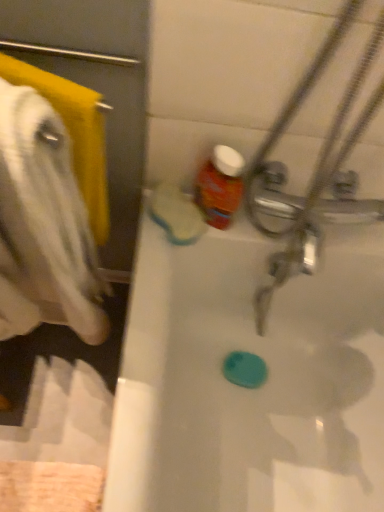
Identify the location of white glossy bathtub at center. (249, 390).

The image size is (384, 512). Find the location of `matte plastic bottle at upper center`. matte plastic bottle at upper center is located at coordinates (220, 186).

Which of these two, white glossy bathtub at center or matte plastic bottle at upper center, is thinner?

With smaller width is matte plastic bottle at upper center.

Are white glossy bathtub at center and matte plastic bottle at upper center located far from each other?

No, white glossy bathtub at center is not far away from matte plastic bottle at upper center.

Which is closer to the camera, (172, 169) or (210, 178)?

Point (172, 169) is farther from the camera than point (210, 178).

Is white glossy bathtub at center in front of matte plastic bottle at upper center?

Yes, white glossy bathtub at center is closer to the viewer.

In the scene shown: What's the angular difference between matte plastic bottle at upper center and white glossy bathtub at center's facing directions?

The angular difference between matte plastic bottle at upper center and white glossy bathtub at center is 92.3 degrees.

Would you consider matte plastic bottle at upper center to be distant from white glossy bathtub at center?

No, there isn't a large distance between matte plastic bottle at upper center and white glossy bathtub at center.

Who is taller, matte plastic bottle at upper center or white glossy bathtub at center?

With more height is white glossy bathtub at center.

Where is `bottle above the white glossy bathtub at center (from a real-world perspective)`? The width and height of the screenshot is (384, 512). bottle above the white glossy bathtub at center (from a real-world perspective) is located at coordinates (220, 186).

Who is taller, white soft towel at left or white glossy bathtub at center?

With more height is white glossy bathtub at center.

The image size is (384, 512). Find the location of `towel/napkin on the left of white glossy bathtub at center`. towel/napkin on the left of white glossy bathtub at center is located at coordinates (74, 133).

Which is behind, point (85, 158) or point (122, 390)?

The point (122, 390) is more distant.

From a real-world perspective, is white soft towel at left located beneath white glossy bathtub at center?

No, from a real-world perspective, white soft towel at left is not under white glossy bathtub at center.

Is matte plastic bottle at upper center not within white soft towel at left?

Absolutely, matte plastic bottle at upper center is external to white soft towel at left.

From a real-world perspective, which is physically above, matte plastic bottle at upper center or white soft towel at left?

From a 3D spatial view, white soft towel at left is above.

From the image's perspective, is matte plastic bottle at upper center on top of white soft towel at left?

No, from the image's perspective, matte plastic bottle at upper center is not over white soft towel at left.

Which object is further away from the camera taking this photo, white soft towel at left or matte plastic bottle at upper center?

matte plastic bottle at upper center is more distant.

Is white soft towel at left facing towards matte plastic bottle at upper center?

No.

Between white soft towel at left and matte plastic bottle at upper center, which one has smaller width?

Thinner between the two is matte plastic bottle at upper center.

Image resolution: width=384 pixels, height=512 pixels. What are the coordinates of `bottle below the white soft towel at left (from a real-world perspective)` in the screenshot? It's located at (220, 186).

Which of these two, white glossy bathtub at center or white soft towel at left, is wider?

Wider between the two is white glossy bathtub at center.

Where is `towel/napkin above the white glossy bathtub at center (from a real-world perspective)`? towel/napkin above the white glossy bathtub at center (from a real-world perspective) is located at coordinates (74, 133).

How different are the orientations of white glossy bathtub at center and white soft towel at left in degrees?

There is a 64.1-degree angle between the facing directions of white glossy bathtub at center and white soft towel at left.

Considering the points (210, 413) and (99, 234), which point is in front, point (210, 413) or point (99, 234)?

The point (99, 234) is more forward.

There is a white glossy bathtub at center. Find the location of `bottle above it (from a real-world perspective)`. bottle above it (from a real-world perspective) is located at coordinates [220, 186].

Locate an element on the screen. bottle located on the left of white glossy bathtub at center is located at coordinates (220, 186).

When comparing their distances from white glossy bathtub at center, does white soft towel at left or matte plastic bottle at upper center seem closer?

matte plastic bottle at upper center is closer to white glossy bathtub at center.

Which object lies further to the anchor point matte plastic bottle at upper center, white glossy bathtub at center or white soft towel at left?

Among the two, white glossy bathtub at center is located further to matte plastic bottle at upper center.

Based on their spatial positions, is matte plastic bottle at upper center or white soft towel at left closer to white glossy bathtub at center?

matte plastic bottle at upper center.

Considering their positions, is white glossy bathtub at center positioned further to white soft towel at left than matte plastic bottle at upper center?

white glossy bathtub at center lies further to white soft towel at left than the other object.

Based on their spatial positions, is matte plastic bottle at upper center or white glossy bathtub at center closer to white soft towel at left?

matte plastic bottle at upper center is closer to white soft towel at left.

Based on their spatial positions, is white soft towel at left or white glossy bathtub at center further from matte plastic bottle at upper center?

Among the two, white glossy bathtub at center is located further to matte plastic bottle at upper center.

The width and height of the screenshot is (384, 512). I want to click on bottle between white soft towel at left and white glossy bathtub at center in the vertical direction, so click(x=220, y=186).